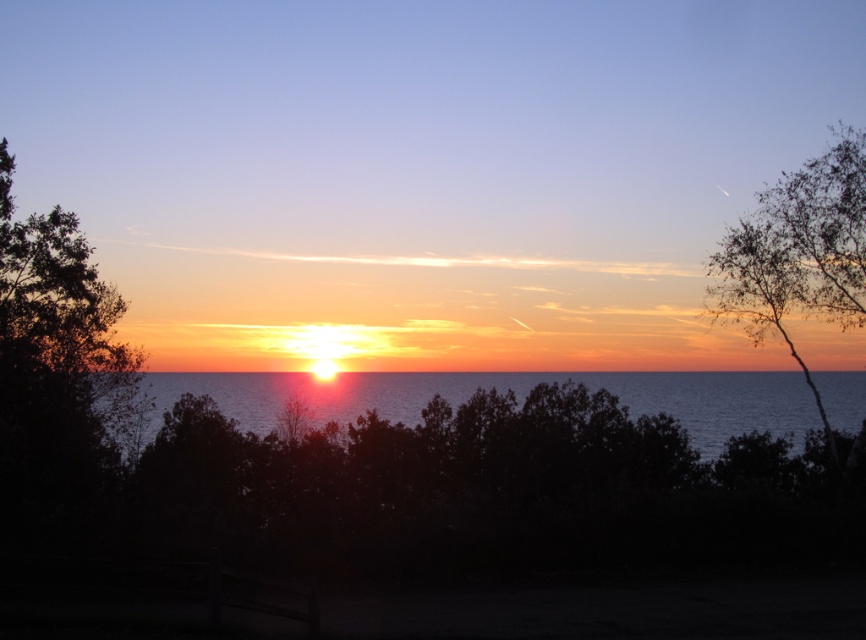
Question: Observing the image, what is the correct spatial positioning of shiny blue water at center in reference to bare branches at right?

Choices:
 (A) above
 (B) below

Answer: (B)

Question: Is shiny blue water at center wider than bare branches at right?

Choices:
 (A) yes
 (B) no

Answer: (A)

Question: Which point is closer to the camera taking this photo?

Choices:
 (A) (742, 372)
 (B) (851, 246)

Answer: (B)

Question: Does shiny blue water at center appear over bare branches at right?

Choices:
 (A) yes
 (B) no

Answer: (B)

Question: Which of the following is the farthest from the observer?

Choices:
 (A) bare branches at right
 (B) shiny blue water at center

Answer: (B)